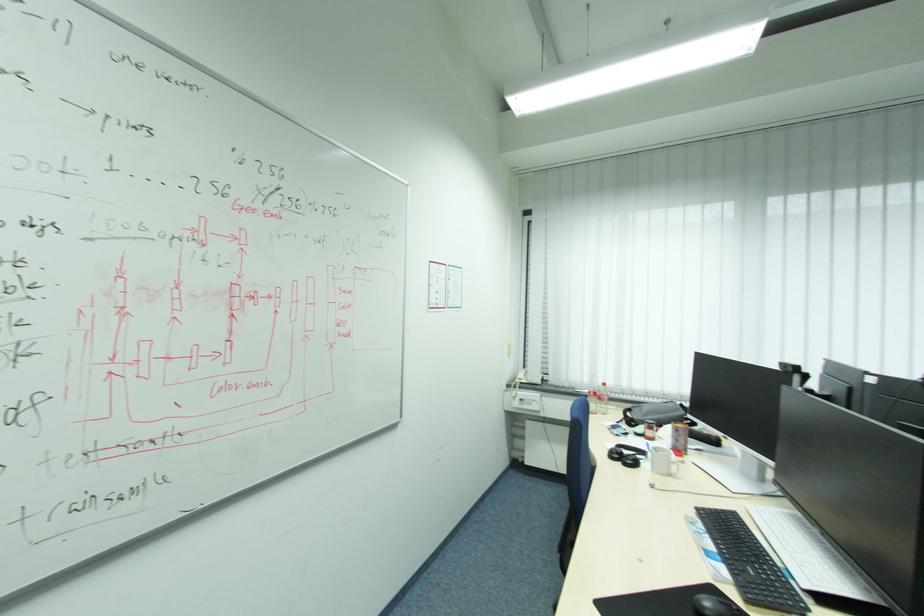
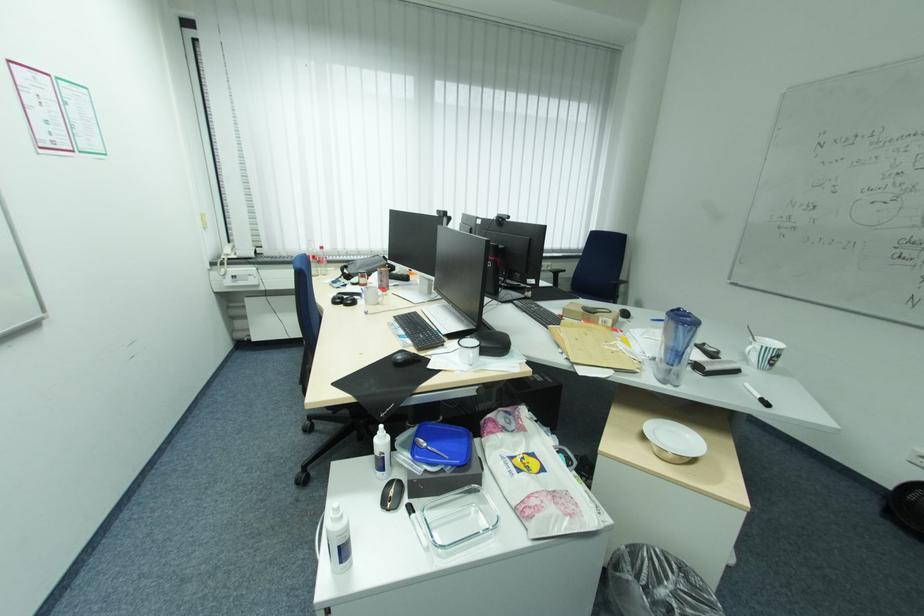
Find the pixel in the second image that matches pixel 626 464 in the first image.

(348, 305)